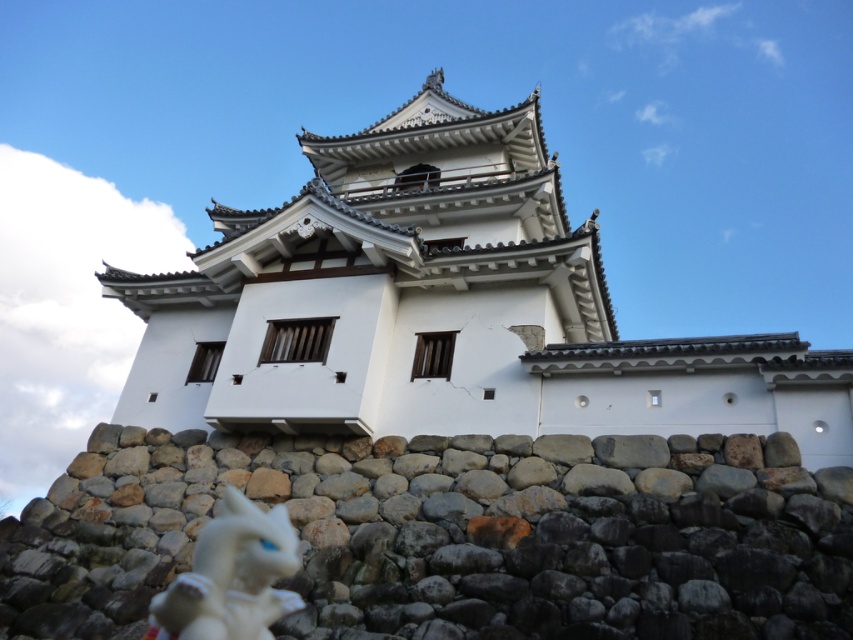
Question: Can you confirm if rough stone wall at lower center is positioned above white glossy figurine at lower left?

Choices:
 (A) yes
 (B) no

Answer: (A)

Question: Is rough stone wall at lower center closer to the viewer compared to white glossy figurine at lower left?

Choices:
 (A) yes
 (B) no

Answer: (B)

Question: Among these objects, which one is farthest from the camera?

Choices:
 (A) white glossy figurine at lower left
 (B) rough stone wall at lower center
 (C) white stone fort at center

Answer: (C)

Question: Which of the following is the closest to the observer?

Choices:
 (A) white glossy figurine at lower left
 (B) rough stone wall at lower center
 (C) white stone fort at center

Answer: (A)

Question: Does white stone fort at center have a greater width compared to white glossy figurine at lower left?

Choices:
 (A) yes
 (B) no

Answer: (A)

Question: Considering the real-world distances, which object is closest to the white stone fort at center?

Choices:
 (A) white glossy figurine at lower left
 (B) rough stone wall at lower center

Answer: (B)